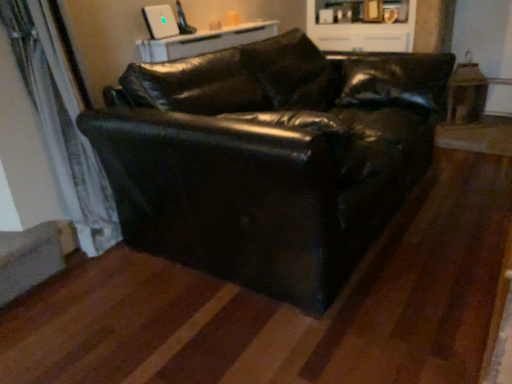
Question: Does white glossy table at upper center appear on the right side of black leather couch at center?

Choices:
 (A) no
 (B) yes

Answer: (A)

Question: Considering the relative sizes of white glossy table at upper center and black leather couch at center in the image provided, is white glossy table at upper center smaller than black leather couch at center?

Choices:
 (A) yes
 (B) no

Answer: (A)

Question: Is white glossy table at upper center oriented away from black leather couch at center?

Choices:
 (A) yes
 (B) no

Answer: (B)

Question: Is white glossy table at upper center positioned far away from black leather couch at center?

Choices:
 (A) no
 (B) yes

Answer: (A)

Question: From a real-world perspective, is white glossy table at upper center under black leather couch at center?

Choices:
 (A) yes
 (B) no

Answer: (B)

Question: Is white glossy cabinet at upper center taller or shorter than white glossy table at upper center?

Choices:
 (A) tall
 (B) short

Answer: (A)

Question: Considering the relative positions of white glossy cabinet at upper center and white glossy table at upper center in the image provided, is white glossy cabinet at upper center to the left or to the right of white glossy table at upper center?

Choices:
 (A) left
 (B) right

Answer: (B)

Question: Is white glossy cabinet at upper center situated inside white glossy table at upper center or outside?

Choices:
 (A) inside
 (B) outside

Answer: (B)

Question: From the image's perspective, is white glossy cabinet at upper center positioned above or below white glossy table at upper center?

Choices:
 (A) below
 (B) above

Answer: (B)

Question: Considering the relative positions of white glossy table at upper center and white sheer curtain at left in the image provided, is white glossy table at upper center to the left or to the right of white sheer curtain at left?

Choices:
 (A) left
 (B) right

Answer: (B)

Question: Which is correct: white glossy table at upper center is inside white sheer curtain at left, or outside of it?

Choices:
 (A) outside
 (B) inside

Answer: (A)

Question: From the image's perspective, is white glossy table at upper center located above or below white sheer curtain at left?

Choices:
 (A) above
 (B) below

Answer: (A)

Question: Considering their positions, is white glossy table at upper center located in front of or behind white sheer curtain at left?

Choices:
 (A) front
 (B) behind

Answer: (B)

Question: Which is correct: black leather couch at center is inside white glossy table at upper center, or outside of it?

Choices:
 (A) inside
 (B) outside

Answer: (B)

Question: Is black leather couch at center bigger or smaller than white glossy table at upper center?

Choices:
 (A) big
 (B) small

Answer: (A)